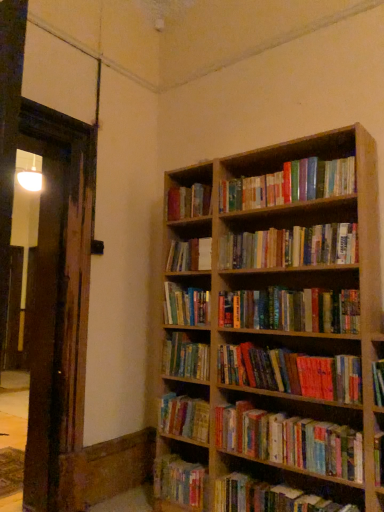
Question: Considering the positions of point (170, 289) and point (276, 182), is point (170, 289) closer or farther from the camera than point (276, 182)?

Choices:
 (A) farther
 (B) closer

Answer: (A)

Question: Considering the positions of hardcover book at center, positioned as the 6th book in top-to-bottom order, and multicolored paperbacks at upper center, which is the first book in top-to-bottom order, in the image, is hardcover book at center, positioned as the 6th book in top-to-bottom order, bigger or smaller than multicolored paperbacks at upper center, which is the first book in top-to-bottom order,?

Choices:
 (A) small
 (B) big

Answer: (A)

Question: Based on their relative distances, which object is farther from the multicolored paperbacks at center, which appears as the fourth book when ordered from the bottom?

Choices:
 (A) hardcover books at upper center, acting as the eleventh book starting from the bottom
 (B) hardcover book at lower center, the 12th book when ordered from top to bottom
 (C) hardcover books at center, which ranks as the tenth book in bottom-to-top order
 (D) hardcover book at lower right, arranged as the second book when ordered from the bottom
 (E) multicolored paperbacks at center, which ranks as the 3th book in bottom-to-top order

Answer: (A)

Question: Which object is the farthest from the multicolored paperbacks at center, which is counted as the 7th book, starting from the top?

Choices:
 (A) hardcover book at center, which is the 4th book in top-to-bottom order
 (B) multicolored paperbacks at center, which appears as the fourth book when ordered from the bottom
 (C) hardcover books at center, placed as the fifth book when sorted from top to bottom
 (D) hardcover book at lower center, the first book when ordered from bottom to top
 (E) hardcover books at center, the third book from the top

Answer: (D)